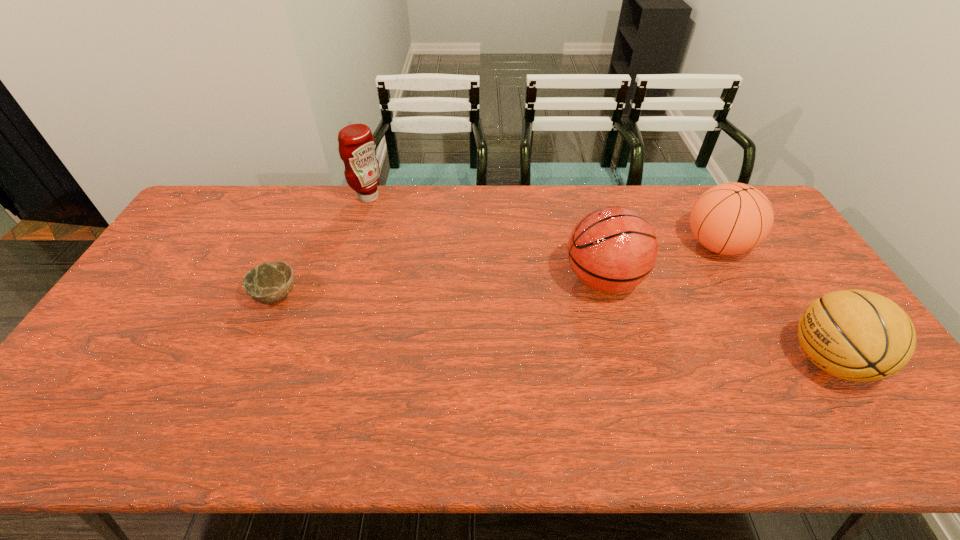
Where is `vacant space located on the surface of the nearest basketball near the brand logo`? vacant space located on the surface of the nearest basketball near the brand logo is located at coordinates (680, 360).

The width and height of the screenshot is (960, 540). I want to click on free location located 0.400m on the surface of the nearest basketball near the brand logo, so click(x=628, y=360).

Where is `vacant area situated 0.160m on the surface of the nearest basketball near the brand logo`? Image resolution: width=960 pixels, height=540 pixels. vacant area situated 0.160m on the surface of the nearest basketball near the brand logo is located at coordinates pos(723,360).

The width and height of the screenshot is (960, 540). Find the location of `free space located on the front of the bowl`. free space located on the front of the bowl is located at coordinates (252, 350).

In order to click on condiment located in the far edge section of the desktop in this screenshot , I will do `click(356, 147)`.

Where is `basketball present at the far edge`? basketball present at the far edge is located at coordinates (732, 218).

Identify the location of object located at the far right corner. Image resolution: width=960 pixels, height=540 pixels. (732, 218).

The height and width of the screenshot is (540, 960). I want to click on vacant space at the far edge, so click(x=435, y=224).

Identify the location of free space at the near edge of the desktop. The height and width of the screenshot is (540, 960). (491, 446).

In the image, there is a desktop. Identify the location of free region at the left edge. The image size is (960, 540). (133, 350).